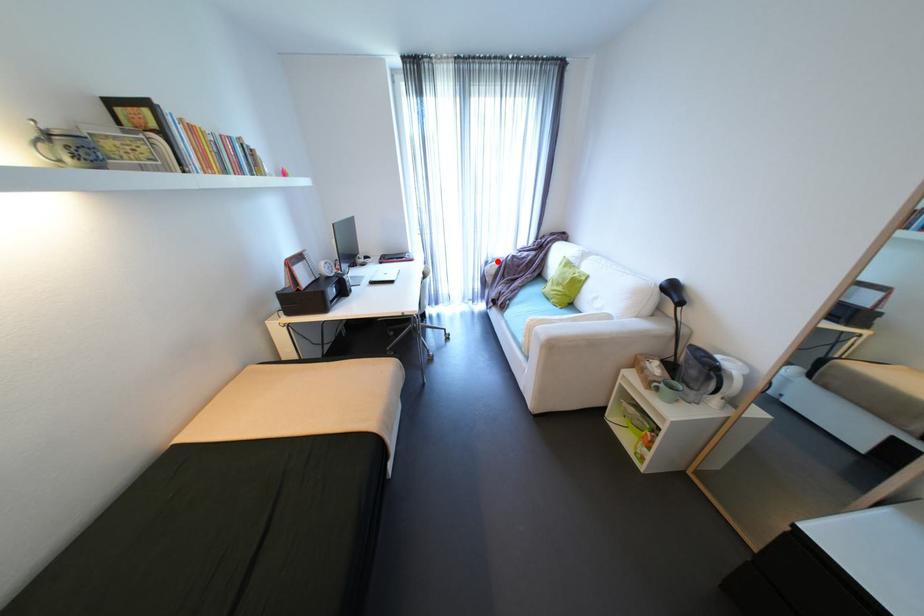
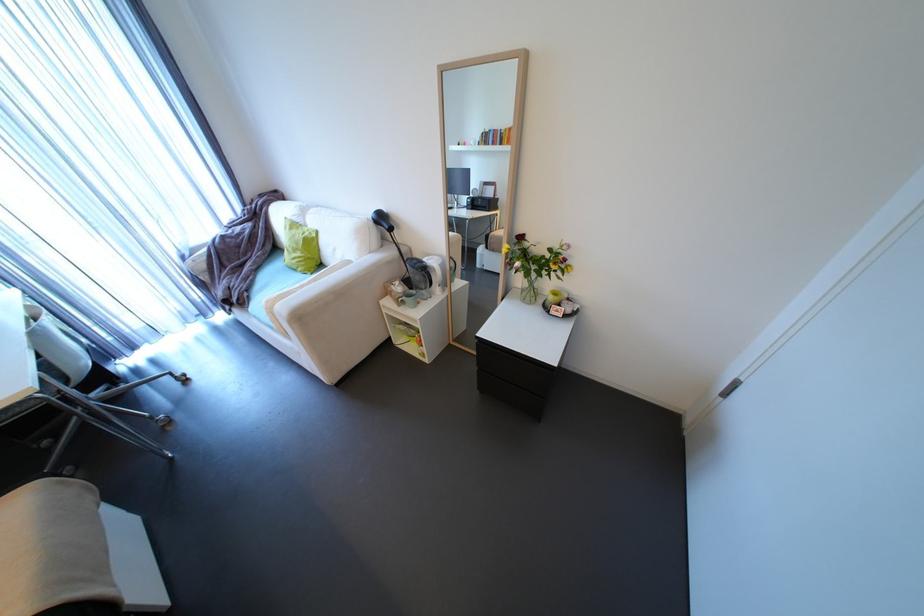
In the second image, find the point that corresponds to the highlighted location in the first image.

(195, 254)